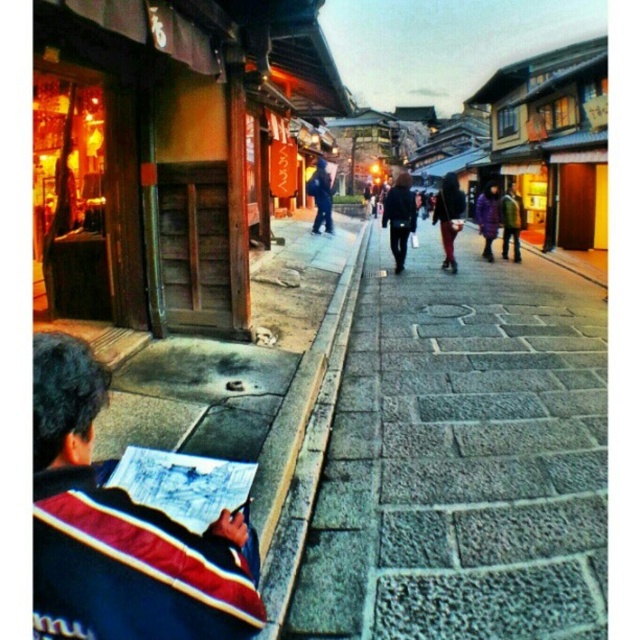
Question: Which is nearer to the gray concrete curb at center?

Choices:
 (A) dark blue jeans at center
 (B) dark blue jacket at center
 (C) striped fleece jacket at lower left

Answer: (C)

Question: Does dark blue jeans at center lie in front of purple fabric jacket at center?

Choices:
 (A) no
 (B) yes

Answer: (B)

Question: Observing the image, what is the correct spatial positioning of wooden signboard at upper left in reference to blue denim jacket at center?

Choices:
 (A) above
 (B) below

Answer: (B)

Question: Among these points, which one is farthest from the camera?

Choices:
 (A) (451, 202)
 (B) (272, 465)

Answer: (A)

Question: Can you confirm if striped fleece jacket at lower left is bigger than blue denim jacket at center?

Choices:
 (A) yes
 (B) no

Answer: (B)

Question: Which object appears closest to the camera in this image?

Choices:
 (A) purple fabric jacket at center
 (B) gray concrete curb at center
 (C) striped fleece jacket at lower left
 (D) wooden signboard at upper left

Answer: (C)